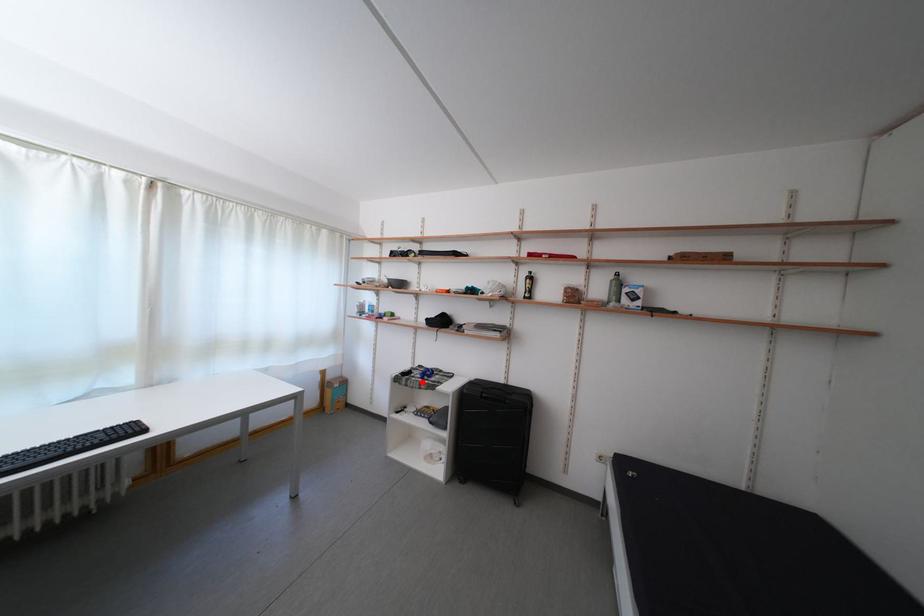
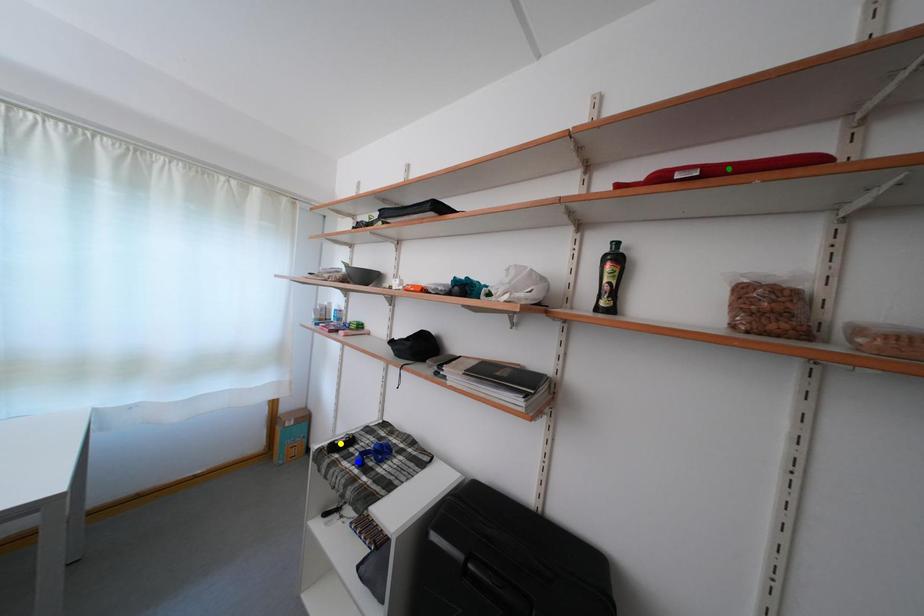
Question: I am providing you with two images of the same scene from different viewpoints. A red point is marked on the first image. You are given multiple points on the second image. Which spot in image 2 lines up with the point in image 1?

Choices:
 (A) green point
 (B) yellow point
 (C) blue point

Answer: (C)